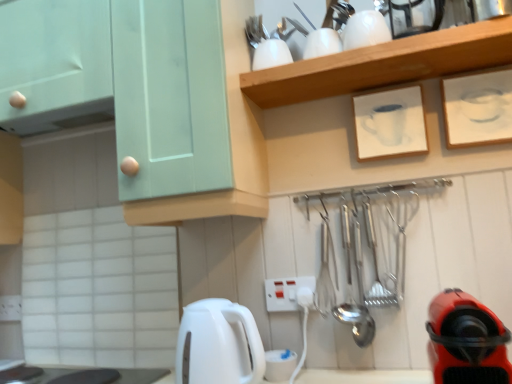
What do you see at coordinates (365, 30) in the screenshot? I see `white glossy teapot at upper center, which is the second appliance in right-to-left order` at bounding box center [365, 30].

Identify the location of white paper at upper right, which is counted as the second picture frame, starting from the left. (478, 108).

Identify the location of white matte picture frame at upper center, acting as the 1th picture frame starting from the left. (390, 123).

What do you see at coordinates (390, 123) in the screenshot? I see `white matte picture frame at upper center, acting as the 1th picture frame starting from the left` at bounding box center [390, 123].

Find the location of `red rubber vacuum cleaner at lower right`. red rubber vacuum cleaner at lower right is located at coordinates (466, 341).

Find the location of `white glossy electric kettle at lower center`. white glossy electric kettle at lower center is located at coordinates (218, 344).

Who is taller, white paper at upper right, which is counted as the second picture frame, starting from the left, or red rubber vacuum cleaner at lower right?

Standing taller between the two is red rubber vacuum cleaner at lower right.

From a real-world perspective, is white paper at upper right, the 1th picture frame positioned from the right, below red rubber vacuum cleaner at lower right?

Incorrect, from a real-world perspective, white paper at upper right, the 1th picture frame positioned from the right, is higher than red rubber vacuum cleaner at lower right.

Is white paper at upper right, the 1th picture frame positioned from the right, facing away from red rubber vacuum cleaner at lower right?

white paper at upper right, the 1th picture frame positioned from the right, is not turned away from red rubber vacuum cleaner at lower right.

In the image, is white paper at upper right, which is counted as the second picture frame, starting from the left, on the left side or the right side of red rubber vacuum cleaner at lower right?

Based on their positions, white paper at upper right, which is counted as the second picture frame, starting from the left, is located to the right of red rubber vacuum cleaner at lower right.

Between white glossy cups at upper center and black glossy countertop at lower left, which one appears on the left side from the viewer's perspective?

Positioned to the left is black glossy countertop at lower left.

What's the angular difference between white glossy cups at upper center and black glossy countertop at lower left's facing directions?

0.404 degrees separate the facing orientations of white glossy cups at upper center and black glossy countertop at lower left.

Is white glossy cups at upper center wider or thinner than black glossy countertop at lower left?

Clearly, white glossy cups at upper center has less width compared to black glossy countertop at lower left.

Which point is more forward, [291,86] or [27,368]?

The point [291,86] is closer to the camera.

How many degrees apart are the facing directions of white glossy electric kettle at lower center and white glossy cups at upper center?

The angular difference between white glossy electric kettle at lower center and white glossy cups at upper center is 8.13 degrees.

Can you confirm if white glossy electric kettle at lower center is positioned to the right of white glossy cups at upper center?

No.

Looking at this image, from a real-world perspective, is white glossy electric kettle at lower center over white glossy cups at upper center?

Actually, white glossy electric kettle at lower center is physically below white glossy cups at upper center in the real world.

From the picture: Is white glossy electric kettle at lower center positioned with its back to white glossy cups at upper center?

No.

From the picture: How distant is white plastic electric outlet at center from white matte picture frame at upper center, the second picture frame in the right-to-left sequence?

white plastic electric outlet at center is 18.16 inches from white matte picture frame at upper center, the second picture frame in the right-to-left sequence.

Considering the relative sizes of white plastic electric outlet at center and white matte picture frame at upper center, acting as the 1th picture frame starting from the left, in the image provided, is white plastic electric outlet at center shorter than white matte picture frame at upper center, acting as the 1th picture frame starting from the left,?

Yes, white plastic electric outlet at center is shorter than white matte picture frame at upper center, acting as the 1th picture frame starting from the left.

Which object is thinner, white plastic electric outlet at center or white matte picture frame at upper center, the second picture frame in the right-to-left sequence?

white plastic electric outlet at center.

Is white plastic electric outlet at center completely or partially outside of white matte picture frame at upper center, acting as the 1th picture frame starting from the left?

Indeed, white plastic electric outlet at center is completely outside white matte picture frame at upper center, acting as the 1th picture frame starting from the left.

Is white glossy electric kettle at lower center facing towards white paper at upper right, the 1th picture frame positioned from the right?

No, white glossy electric kettle at lower center does not turn towards white paper at upper right, the 1th picture frame positioned from the right.

Starting from the white glossy electric kettle at lower center, which picture frame is the 2nd one to the right? Please provide its 2D coordinates.

[(478, 108)]

From the image's perspective, is white glossy electric kettle at lower center positioned above or below white paper at upper right, which is counted as the second picture frame, starting from the left?

white glossy electric kettle at lower center is situated lower than white paper at upper right, which is counted as the second picture frame, starting from the left, in the image.

Does white glossy electric kettle at lower center have a larger size compared to white paper at upper right, the 1th picture frame positioned from the right?

Yes, white glossy electric kettle at lower center is bigger than white paper at upper right, the 1th picture frame positioned from the right.

Considering the sizes of objects black glossy countertop at lower left and red rubber vacuum cleaner at lower right in the image provided, who is thinner, black glossy countertop at lower left or red rubber vacuum cleaner at lower right?

Thinner between the two is red rubber vacuum cleaner at lower right.

How different are the orientations of black glossy countertop at lower left and red rubber vacuum cleaner at lower right in degrees?

black glossy countertop at lower left and red rubber vacuum cleaner at lower right are facing 0.71 degrees away from each other.

Locate an element on the screen. This screenshot has width=512, height=384. counter top below the red rubber vacuum cleaner at lower right (from a real-world perspective) is located at coordinates (81, 375).

Does point (42, 377) come farther from viewer compared to point (483, 309)?

Yes, it is behind point (483, 309).

Is white matte picture frame at upper center, acting as the 1th picture frame starting from the left, bigger than white glossy cups at upper center?

No.

Can you confirm if white matte picture frame at upper center, acting as the 1th picture frame starting from the left, is wider than white glossy cups at upper center?

In fact, white matte picture frame at upper center, acting as the 1th picture frame starting from the left, might be narrower than white glossy cups at upper center.

Identify the location of shelf that is above the white matte picture frame at upper center, acting as the 1th picture frame starting from the left (from the image's perspective). (384, 64).

Is white matte picture frame at upper center, the second picture frame in the right-to-left sequence, oriented towards white glossy cups at upper center?

No, white matte picture frame at upper center, the second picture frame in the right-to-left sequence, does not turn towards white glossy cups at upper center.

Locate an element on the screen. The width and height of the screenshot is (512, 384). home appliance in front of the white paper at upper right, which is counted as the second picture frame, starting from the left is located at coordinates (466, 341).

At what (x,y) coordinates should I click in order to perform the action: click on counter top on the left of white glossy cups at upper center. Please return your answer as a coordinate pair (x, y). The width and height of the screenshot is (512, 384). Looking at the image, I should click on (81, 375).

Which object lies nearer to the anchor point white glossy cups at upper center, red rubber vacuum cleaner at lower right or black glossy countertop at lower left?

Based on the image, red rubber vacuum cleaner at lower right appears to be nearer to white glossy cups at upper center.

From the image, which object appears to be nearer to white plastic electric outlet at center, white glossy teapot at upper center, the first appliance positioned from the left, or white paper at upper right, which is counted as the second picture frame, starting from the left?

Based on the image, white paper at upper right, which is counted as the second picture frame, starting from the left, appears to be nearer to white plastic electric outlet at center.

Which object lies further to the anchor point white glossy teapot at upper center, which is the second appliance in right-to-left order, white glossy cups at upper center or white matte picture frame at upper center, acting as the 1th picture frame starting from the left?

white matte picture frame at upper center, acting as the 1th picture frame starting from the left, is positioned further to the anchor white glossy teapot at upper center, which is the second appliance in right-to-left order.

Considering their positions, is metallic silver kettle at upper right, marked as the 2th appliance in a left-to-right arrangement, positioned closer to white glossy cups at upper center than white glossy teapot at upper center, which is the second appliance in right-to-left order?

Among the two, white glossy teapot at upper center, which is the second appliance in right-to-left order, is located nearer to white glossy cups at upper center.

Looking at the image, which one is located closer to red rubber vacuum cleaner at lower right, white plastic electric outlet at center or black glossy countertop at lower left?

white plastic electric outlet at center.

Based on their spatial positions, is black glossy countertop at lower left or white paper at upper right, the 1th picture frame positioned from the right, further from white matte picture frame at upper center, acting as the 1th picture frame starting from the left?

Among the two, black glossy countertop at lower left is located further to white matte picture frame at upper center, acting as the 1th picture frame starting from the left.

Estimate the real-world distances between objects in this image. Which object is closer to black glossy countertop at lower left, white glossy electric kettle at lower center or metallic silver kettle at upper right, which appears as the 1th appliance when viewed from the right?

white glossy electric kettle at lower center lies closer to black glossy countertop at lower left than the other object.

When comparing their distances from mint green cabinet at upper left, does white glossy cups at upper center or white glossy teapot at upper center, the first appliance positioned from the left, seem closer?

The object closer to mint green cabinet at upper left is white glossy cups at upper center.

This screenshot has height=384, width=512. I want to click on home appliance that lies between white glossy teapot at upper center, which is the second appliance in right-to-left order, and white plastic electric outlet at center from top to bottom, so click(466, 341).

Locate an element on the screen. electric outlet between metallic silver kettle at upper right, which appears as the 1th appliance when viewed from the right, and black glossy countertop at lower left in the up-down direction is located at coordinates (285, 292).

Where is `cabinetry between black glossy countertop at lower left and red rubber vacuum cleaner at lower right from left to right`? The width and height of the screenshot is (512, 384). cabinetry between black glossy countertop at lower left and red rubber vacuum cleaner at lower right from left to right is located at coordinates (214, 146).

Locate an element on the screen. appliance between metallic silver kettle at upper right, which appears as the 1th appliance when viewed from the right, and white matte picture frame at upper center, the second picture frame in the right-to-left sequence, from top to bottom is located at coordinates (365, 30).